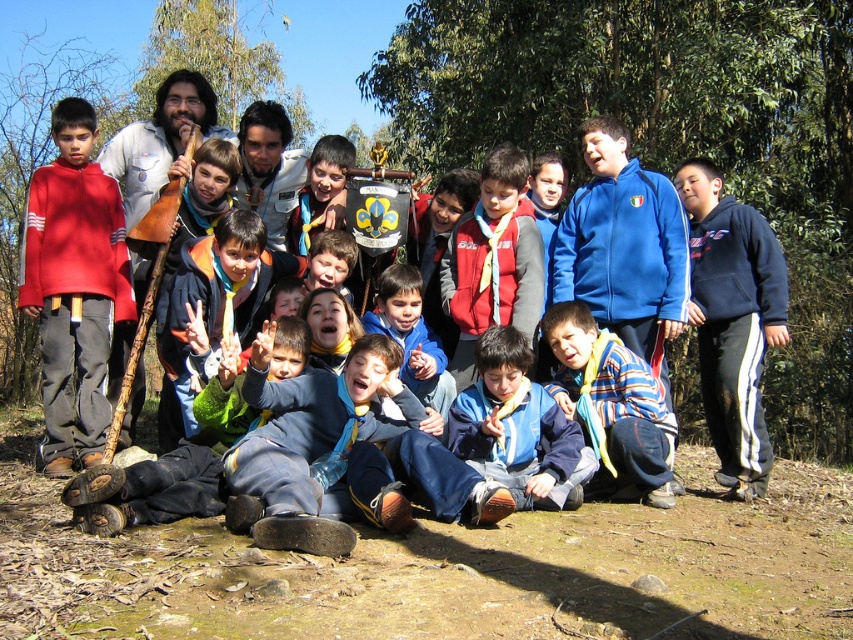
You are part of the group in the image and want to locate the blue fabric shirt at center and the red fleece vest at center. Which one is positioned to the left?

The blue fabric shirt at center is to the left of the red fleece vest at center.

You are standing in the middle of the group and want to move towards the point closer to the camera between point (543, 262) and point (583, 353). Which point should you move towards?

You should move towards point (543, 262) because it is further to the camera than point (583, 353).